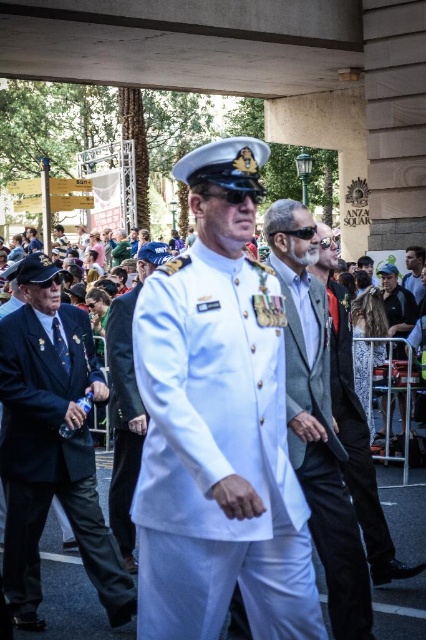
Who is more distant from viewer, [270,228] or [347,442]?

Positioned behind is point [270,228].

Is gray wool suit at center bigger than translucent plastic bag at center?

Yes, gray wool suit at center is bigger than translucent plastic bag at center.

Locate an element on the screen. gray wool suit at center is located at coordinates (316, 419).

Find the location of a particular element. This screenshot has height=640, width=426. gray wool suit at center is located at coordinates (316, 419).

From the picture: Between white matte uniform at center and white uniform at center, which one is positioned higher?

white matte uniform at center is higher up.

Identify the location of white matte uniform at center. (216, 456).

Which is above, white uniform at center or black textured dress at right?

black textured dress at right is higher up.

Identify the location of white uniform at center. (126, 403).

Identify the location of white uniform at center. The width and height of the screenshot is (426, 640). (126, 403).